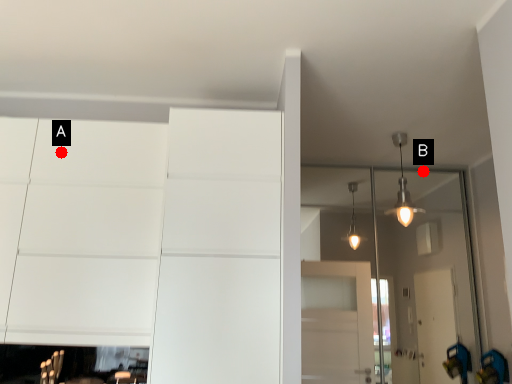
Question: Two points are circled on the image, labeled by A and B beside each circle. Which point is farther from the camera taking this photo?

Choices:
 (A) A is further
 (B) B is further

Answer: (B)